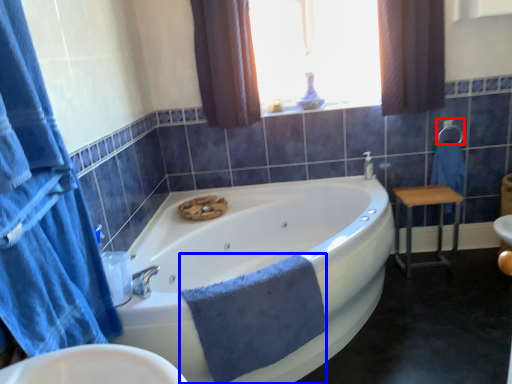
Question: Which point is closer to the camera, towel bar (highlighted by a red box) or bath towel (highlighted by a blue box)?

Choices:
 (A) towel bar
 (B) bath towel

Answer: (B)